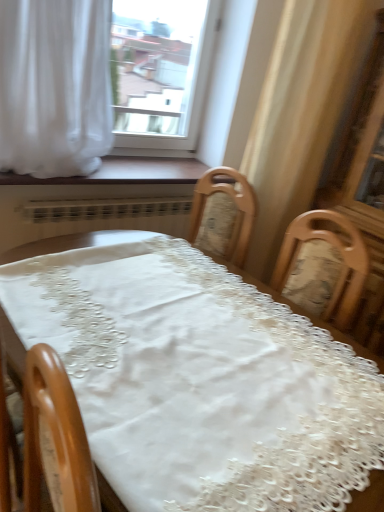
This screenshot has height=512, width=384. Describe the element at coordinates (111, 426) in the screenshot. I see `white lace tablecloth at center` at that location.

Locate an element on the screen. Image resolution: width=384 pixels, height=512 pixels. white sheer curtain at upper left is located at coordinates (55, 86).

How distant is white sheer curtain at upper left from transparent glass window at upper center?

5.20 feet.

Based on the photo, can you confirm if white sheer curtain at upper left is taller than transparent glass window at upper center?

No.

From the image's perspective, is white sheer curtain at upper left on top of transparent glass window at upper center?

Incorrect, from the image's perspective, white sheer curtain at upper left is lower than transparent glass window at upper center.

Where is `window above the white sheer curtain at upper left (from a real-world perspective)`? Image resolution: width=384 pixels, height=512 pixels. window above the white sheer curtain at upper left (from a real-world perspective) is located at coordinates (162, 71).

Would you say white sheer curtain at upper left is to the left or to the right of white lace tablecloth at center in the picture?

From the image, it's evident that white sheer curtain at upper left is to the left of white lace tablecloth at center.

Between point (42, 14) and point (260, 341), which one is positioned in front?

The point (260, 341) is closer.

Can you confirm if white sheer curtain at upper left is smaller than white lace tablecloth at center?

Indeed, white sheer curtain at upper left has a smaller size compared to white lace tablecloth at center.

Is white lace tablecloth at center positioned with its back to white sheer curtain at upper left?

white lace tablecloth at center is not turned away from white sheer curtain at upper left.

The height and width of the screenshot is (512, 384). Identify the location of curtain on the left of white lace tablecloth at center. (55, 86).

How distant is white lace tablecloth at center from white sheer curtain at upper left?

white lace tablecloth at center is 27.17 inches away from white sheer curtain at upper left.

From the image's perspective, between transparent glass window at upper center and white lace tablecloth at center, which one is located above?

From the image's view, transparent glass window at upper center is above.

Based on their sizes in the image, would you say transparent glass window at upper center is bigger or smaller than white lace tablecloth at center?

Considering their sizes, transparent glass window at upper center takes up less space than white lace tablecloth at center.

Is transparent glass window at upper center oriented towards white lace tablecloth at center?

Yes, transparent glass window at upper center is oriented towards white lace tablecloth at center.

From a real-world perspective, which is physically below, transparent glass window at upper center or white lace tablecloth at center?

white lace tablecloth at center.

Is transparent glass window at upper center completely or partially inside wooden at lower center?

No, transparent glass window at upper center is located outside of wooden at lower center.

Is wooden at lower center thinner than transparent glass window at upper center?

No, wooden at lower center is not thinner than transparent glass window at upper center.

Does point (188, 169) lie behind point (183, 59)?

No.

You are a GUI agent. You are given a task and a screenshot of the screen. Output one action in this format:
    pyautogui.click(x=<x>, y=<y>)
    Task: Click on the window behind the wooden at lower center
    The width and height of the screenshot is (384, 512).
    Given the screenshot: What is the action you would take?
    pyautogui.click(x=162, y=71)

Who is taller, wooden at lower center or white sheer curtain at upper left?

white sheer curtain at upper left.

Which is in front, wooden at lower center or white sheer curtain at upper left?

Positioned in front is white sheer curtain at upper left.

Is wooden at lower center smaller than white sheer curtain at upper left?

Yes, wooden at lower center is smaller than white sheer curtain at upper left.

Considering the positions of objects white sheer curtain at upper left and wooden at lower center in the image provided, who is more to the right, white sheer curtain at upper left or wooden at lower center?

wooden at lower center.

Based on their sizes in the image, would you say white sheer curtain at upper left is bigger or smaller than wooden at lower center?

Clearly, white sheer curtain at upper left is larger in size than wooden at lower center.

In terms of width, does white sheer curtain at upper left look wider or thinner when compared to wooden at lower center?

white sheer curtain at upper left is wider than wooden at lower center.

Find the location of a particular element. Image resolution: width=384 pixels, height=512 pixels. window located above the white sheer curtain at upper left (from the image's perspective) is located at coordinates coord(162,71).

You are a GUI agent. You are given a task and a screenshot of the screen. Output one action in this format:
    pyautogui.click(x=<x>, y=<y>)
    Task: Click on the table located underneath the white sheer curtain at upper left (from a real-world perspective)
    This screenshot has height=512, width=384.
    Given the screenshot: What is the action you would take?
    pyautogui.click(x=111, y=426)

Looking at the image, which one is located closer to white lace tablecloth at center, transparent glass window at upper center or white sheer curtain at upper left?

white sheer curtain at upper left lies closer to white lace tablecloth at center than the other object.

Considering their positions, is white sheer curtain at upper left positioned closer to wooden at lower center than white lace tablecloth at center?

white sheer curtain at upper left.

Which object lies nearer to the anchor point white sheer curtain at upper left, wooden at lower center or white lace tablecloth at center?

wooden at lower center is closer to white sheer curtain at upper left.

Based on the photo, when comparing their distances from wooden at lower center, does white sheer curtain at upper left or transparent glass window at upper center seem closer?

The object closer to wooden at lower center is white sheer curtain at upper left.

Estimate the real-world distances between objects in this image. Which object is closer to white sheer curtain at upper left, white lace tablecloth at center or transparent glass window at upper center?

white lace tablecloth at center is closer to white sheer curtain at upper left.

Estimate the real-world distances between objects in this image. Which object is closer to transparent glass window at upper center, white sheer curtain at upper left or wooden at lower center?

Based on the image, wooden at lower center appears to be nearer to transparent glass window at upper center.

Based on their spatial positions, is transparent glass window at upper center or white sheer curtain at upper left closer to wooden at lower center?

white sheer curtain at upper left is positioned closer to the anchor wooden at lower center.

Based on their spatial positions, is white lace tablecloth at center or white sheer curtain at upper left further from wooden at lower center?

white lace tablecloth at center lies further to wooden at lower center than the other object.

Identify the location of window sill between white sheer curtain at upper left and transparent glass window at upper center in the front-back direction. Image resolution: width=384 pixels, height=512 pixels. (124, 172).

You are a GUI agent. You are given a task and a screenshot of the screen. Output one action in this format:
    pyautogui.click(x=<x>, y=<y>)
    Task: Click on the curtain between transparent glass window at upper center and white lace tablecloth at center in the up-down direction
    The width and height of the screenshot is (384, 512).
    Given the screenshot: What is the action you would take?
    pyautogui.click(x=55, y=86)

Find the location of a particular element. The image size is (384, 512). window sill that lies between white sheer curtain at upper left and white lace tablecloth at center from top to bottom is located at coordinates (124, 172).

You are a GUI agent. You are given a task and a screenshot of the screen. Output one action in this format:
    pyautogui.click(x=<x>, y=<y>)
    Task: Click on the window sill between transparent glass window at upper center and white lace tablecloth at center vertically
    The image size is (384, 512).
    Given the screenshot: What is the action you would take?
    pyautogui.click(x=124, y=172)